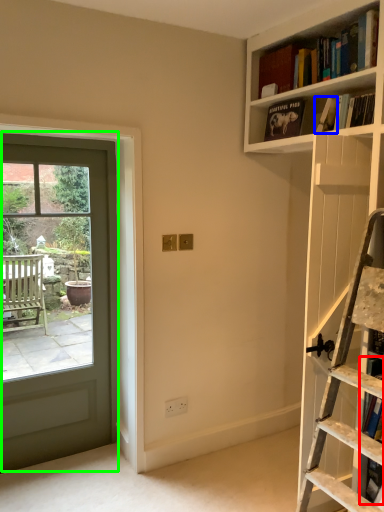
Question: Which is farther away from book (highlighted by a red box)? book (highlighted by a blue box) or door (highlighted by a green box)?

Choices:
 (A) book
 (B) door

Answer: (B)